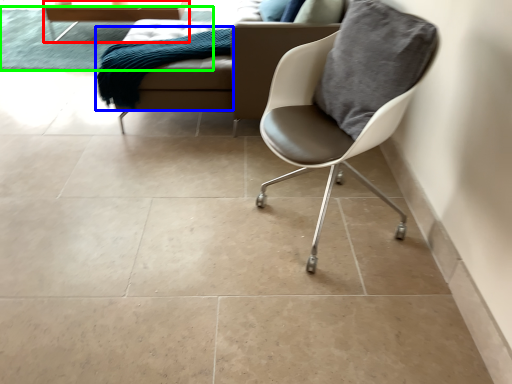
Question: Which object is positioned farthest from table (highlighted by a red box)? Select from material (highlighted by a blue box) and mat (highlighted by a green box).

Choices:
 (A) material
 (B) mat

Answer: (A)